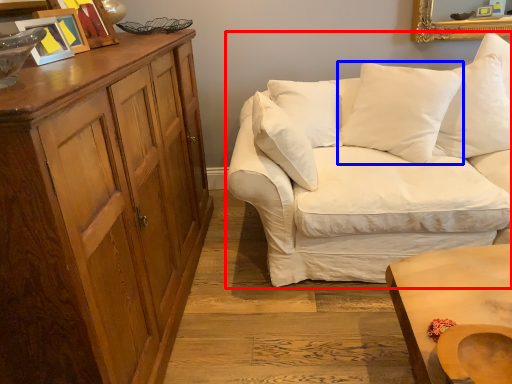
Question: Which object appears closest to the camera in this image, studio couch (highlighted by a red box) or pillow (highlighted by a blue box)?

Choices:
 (A) studio couch
 (B) pillow

Answer: (A)